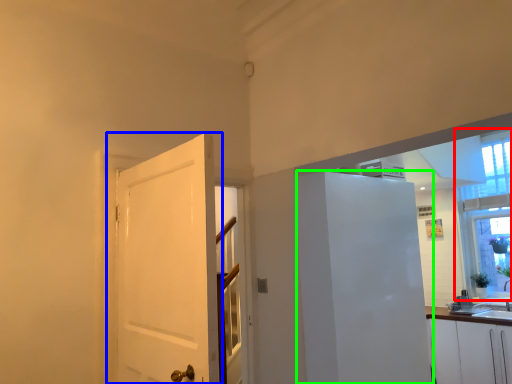
Question: Estimate the real-world distances between objects in this image. Which object is farther from window (highlighted by a red box), door (highlighted by a blue box) or elevator (highlighted by a green box)?

Choices:
 (A) door
 (B) elevator

Answer: (A)